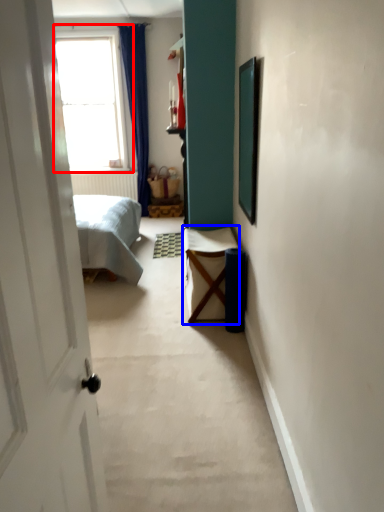
Question: Among these objects, which one is nearest to the camera, window (highlighted by a red box) or furniture (highlighted by a blue box)?

Choices:
 (A) window
 (B) furniture

Answer: (B)